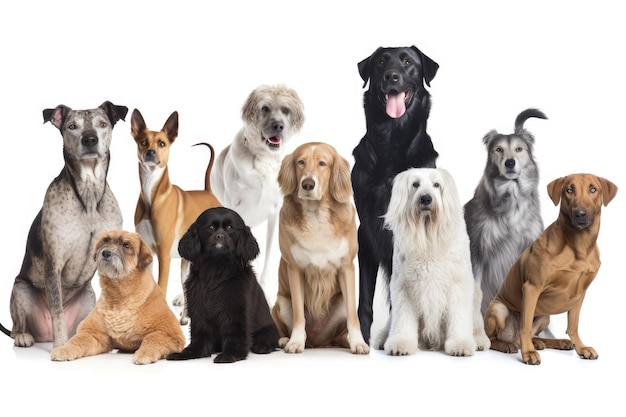
Where is `leg front leg`? leg front leg is located at coordinates (162, 338), (163, 261), (233, 309), (347, 298), (456, 301), (572, 319).